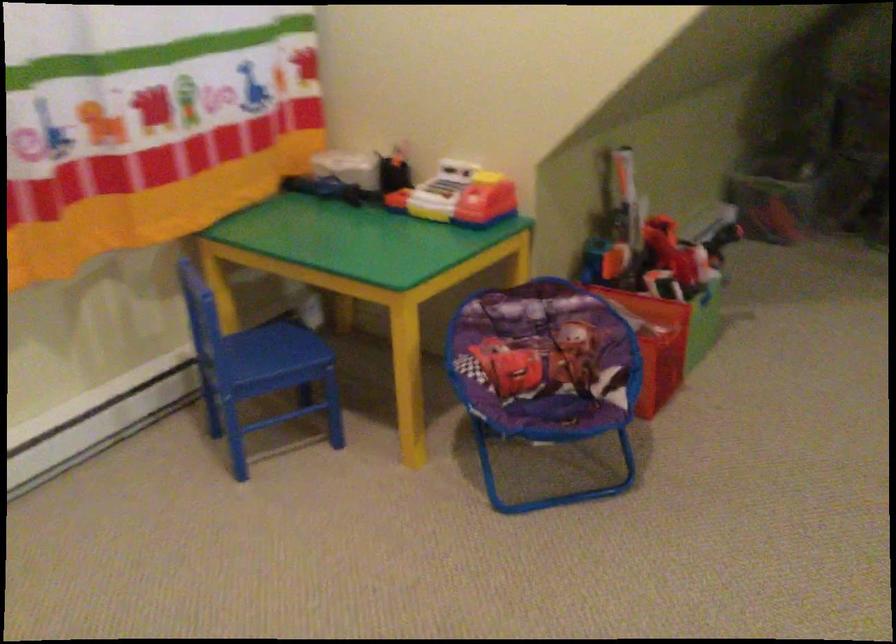
What are the coordinates of `red toy bin` in the screenshot? It's located at (653, 343).